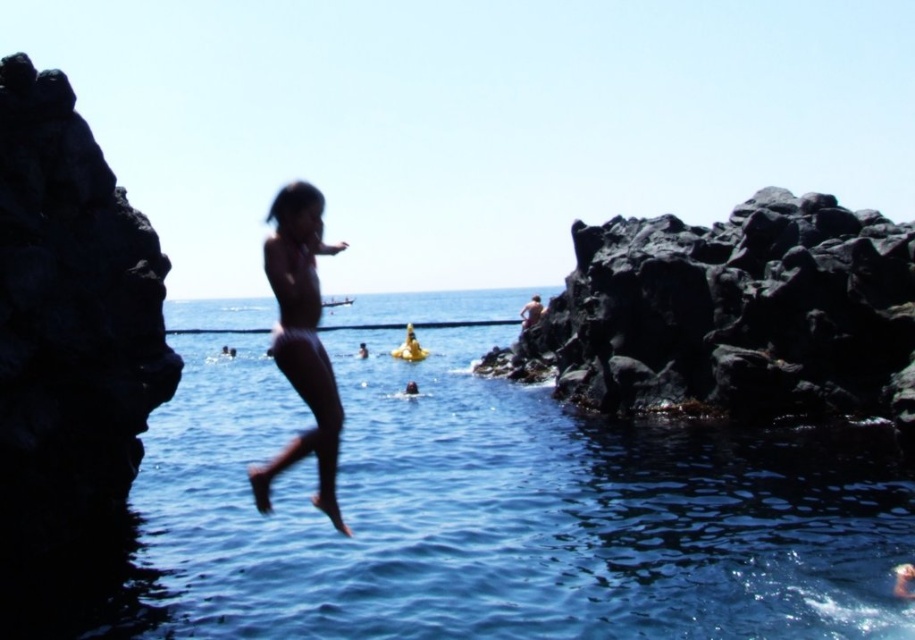
You are a photographer trying to capture the best shot of the smooth skin figure at center and the smooth skin man at center. Since you want to focus on the figure, which one should you adjust your camera to prioritize in the foreground?

The smooth skin figure at center is in front of the smooth skin man at center, so you should prioritize focusing on the smooth skin figure at center to have it in the foreground.